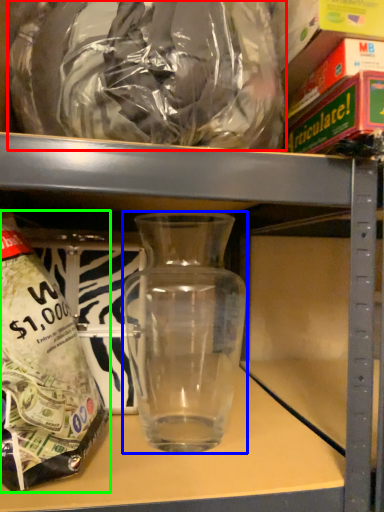
Question: Which object is positioned farthest from plastic bag (highlighted by a red box)? Select from vase (highlighted by a blue box) and bottle (highlighted by a green box).

Choices:
 (A) vase
 (B) bottle

Answer: (A)